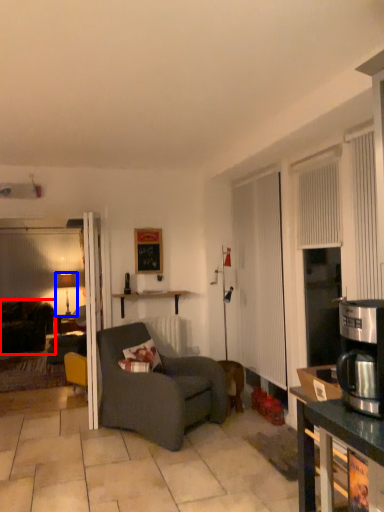
Question: Among these objects, which one is nearest to the camera, studio couch (highlighted by a red box) or lamp (highlighted by a blue box)?

Choices:
 (A) studio couch
 (B) lamp

Answer: (A)